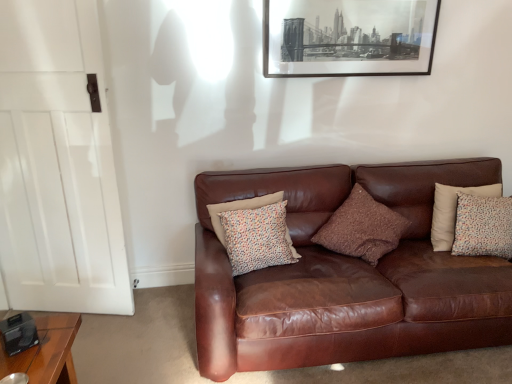
Where is `blank space situated above black matte picture frame at upper center (from a real-world perspective)`? The width and height of the screenshot is (512, 384). blank space situated above black matte picture frame at upper center (from a real-world perspective) is located at coordinates (352, 0).